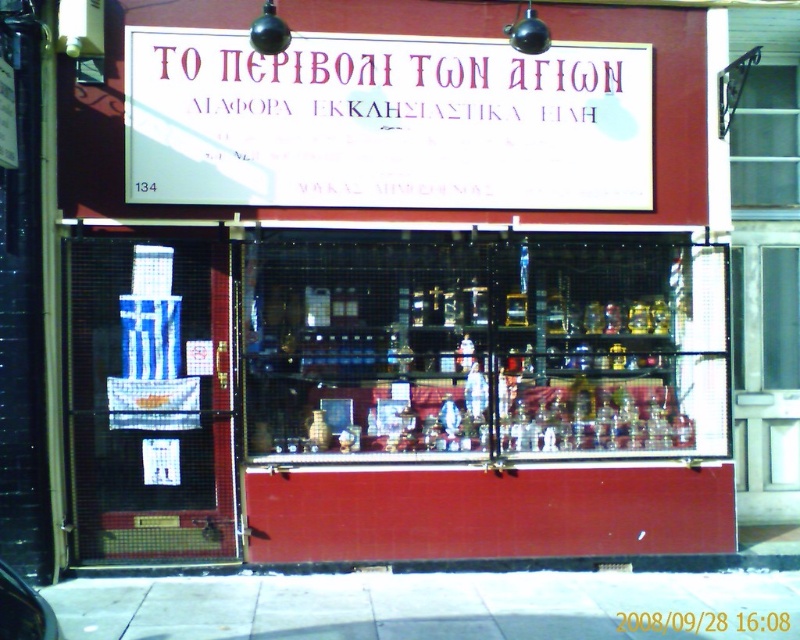
Does white paper sign at upper center have a greater height compared to white concrete pavement at lower center?

Yes, white paper sign at upper center is taller than white concrete pavement at lower center.

Does point (544, 186) lie in front of point (408, 628)?

No, it is not.

You are a GUI agent. You are given a task and a screenshot of the screen. Output one action in this format:
    pyautogui.click(x=<x>, y=<y>)
    Task: Click on the white paper sign at upper center
    Image resolution: width=800 pixels, height=640 pixels.
    Given the screenshot: What is the action you would take?
    pyautogui.click(x=385, y=122)